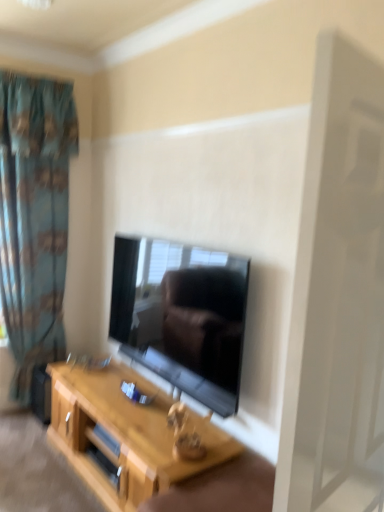
Question: Considering the relative sizes of blue fabric curtain at left and light wood table at center in the image provided, is blue fabric curtain at left shorter than light wood table at center?

Choices:
 (A) yes
 (B) no

Answer: (B)

Question: From a real-world perspective, is blue fabric curtain at left positioned under light wood table at center based on gravity?

Choices:
 (A) no
 (B) yes

Answer: (A)

Question: Could you tell me if blue fabric curtain at left is facing light wood table at center?

Choices:
 (A) yes
 (B) no

Answer: (A)

Question: Is blue fabric curtain at left not close to light wood table at center?

Choices:
 (A) no
 (B) yes

Answer: (B)

Question: Is blue fabric curtain at left not inside light wood table at center?

Choices:
 (A) no
 (B) yes

Answer: (B)

Question: Is the depth of blue fabric curtain at left less than that of light wood table at center?

Choices:
 (A) no
 (B) yes

Answer: (A)

Question: Is black glossy tv at center surrounding light wood table at center?

Choices:
 (A) yes
 (B) no

Answer: (B)

Question: Considering the relative positions of black glossy tv at center and light wood table at center in the image provided, is black glossy tv at center to the right of light wood table at center from the viewer's perspective?

Choices:
 (A) no
 (B) yes

Answer: (B)

Question: Does black glossy tv at center lie in front of light wood table at center?

Choices:
 (A) no
 (B) yes

Answer: (A)

Question: From the image's perspective, is black glossy tv at center below light wood table at center?

Choices:
 (A) no
 (B) yes

Answer: (A)

Question: Is black glossy tv at center smaller than light wood table at center?

Choices:
 (A) no
 (B) yes

Answer: (B)

Question: Does black glossy tv at center have a lesser height compared to light wood table at center?

Choices:
 (A) yes
 (B) no

Answer: (B)

Question: From the image's perspective, is light wood table at center below black glossy tv at center?

Choices:
 (A) yes
 (B) no

Answer: (A)